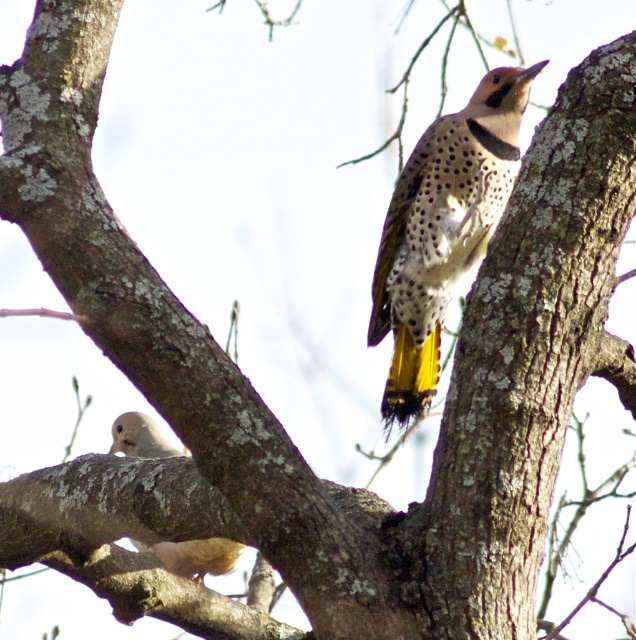
Is point (411, 403) closer to camera compared to point (204, 572)?

Yes, point (411, 403) is in front of point (204, 572).

Find the location of a particular element. This screenshot has width=636, height=640. spotted feathered woodpecker at center is located at coordinates (443, 228).